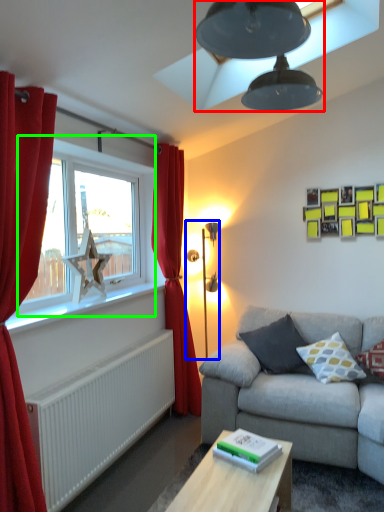
Question: Estimate the real-world distances between objects in this image. Which object is farther from lamp (highlighted by a red box), table lamp (highlighted by a blue box) or window (highlighted by a green box)?

Choices:
 (A) table lamp
 (B) window

Answer: (A)